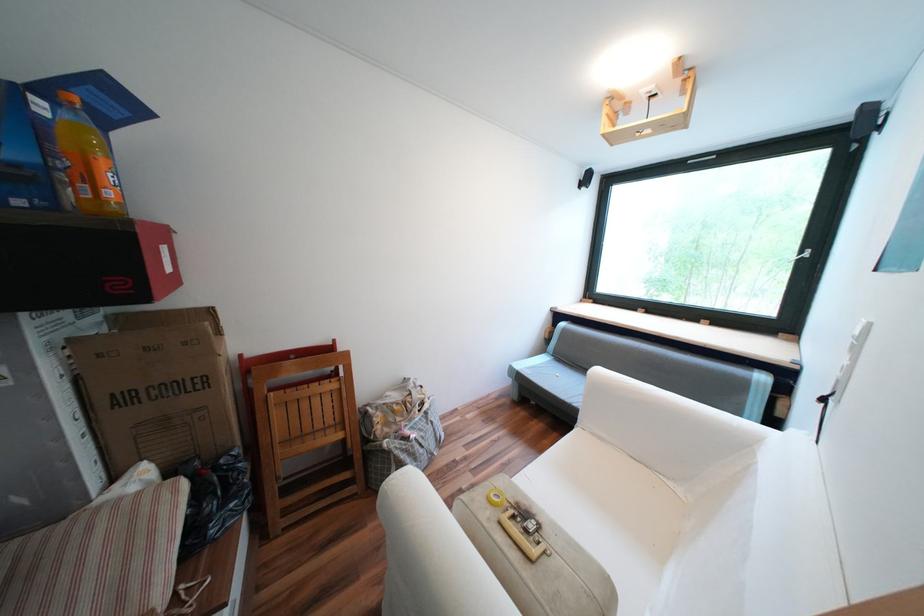
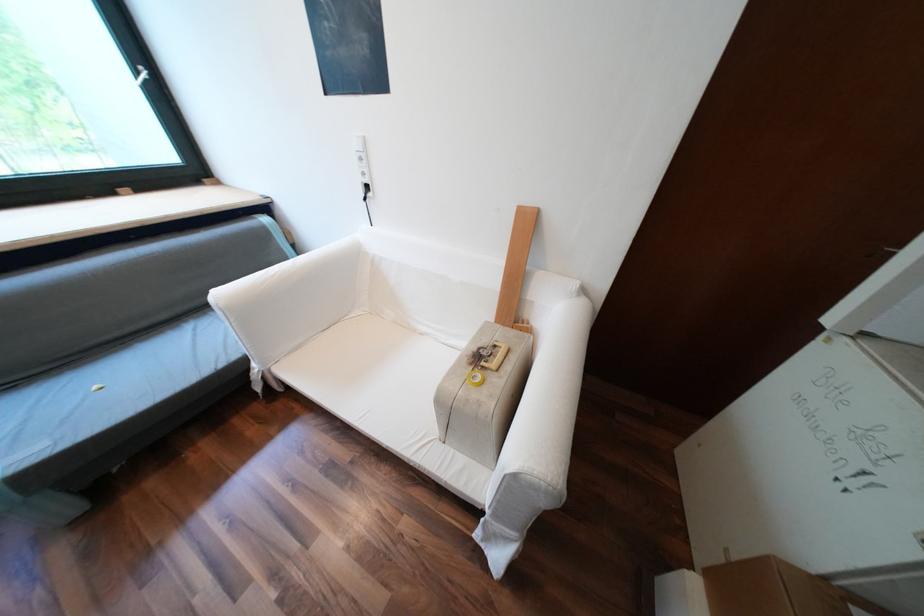
First-person continuous shooting, in which direction is the camera rotating?

The camera's rotation is toward right-down.